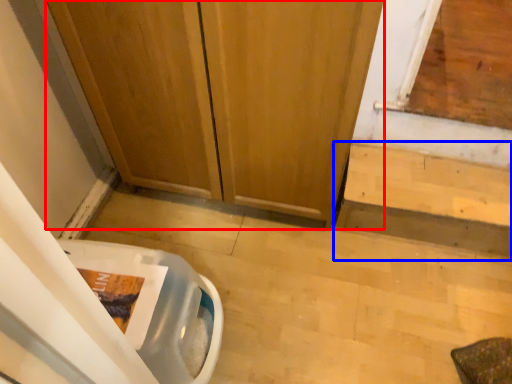
Question: Which point is closer to the camera, door (highlighted by a red box) or stairwell (highlighted by a blue box)?

Choices:
 (A) door
 (B) stairwell

Answer: (A)